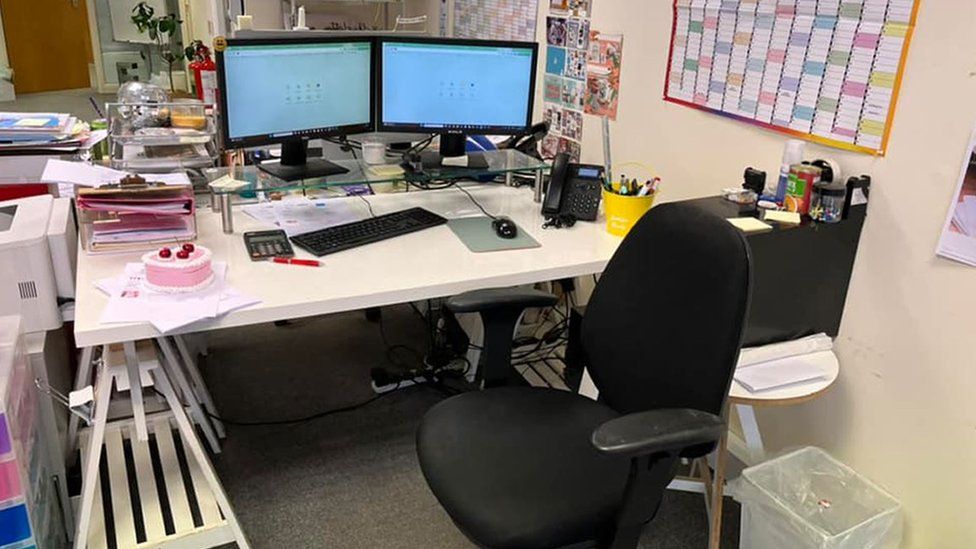
Where is `mouse`? The height and width of the screenshot is (549, 976). mouse is located at coordinates (503, 228).